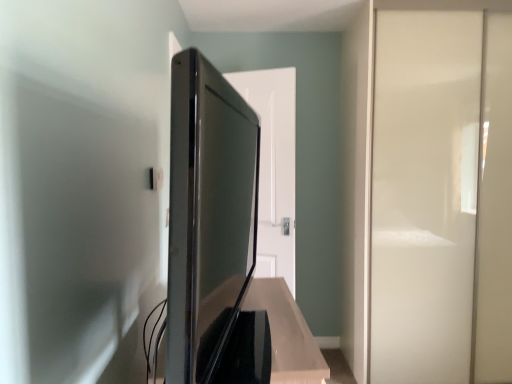
Question: Does satin black tv at center have a greater width compared to white glossy door at center?

Choices:
 (A) no
 (B) yes

Answer: (B)

Question: From the image's perspective, does satin black tv at center appear lower than white glossy door at center?

Choices:
 (A) yes
 (B) no

Answer: (A)

Question: Is satin black tv at center turned away from white glossy door at center?

Choices:
 (A) no
 (B) yes

Answer: (A)

Question: Is satin black tv at center in contact with white glossy door at center?

Choices:
 (A) yes
 (B) no

Answer: (B)

Question: Does satin black tv at center have a lesser height compared to white glossy door at center?

Choices:
 (A) yes
 (B) no

Answer: (A)

Question: Considering the positions of satin black tv at center and white glossy screen door at right in the image, is satin black tv at center bigger or smaller than white glossy screen door at right?

Choices:
 (A) big
 (B) small

Answer: (B)

Question: Is satin black tv at center taller or shorter than white glossy screen door at right?

Choices:
 (A) short
 (B) tall

Answer: (A)

Question: Considering the relative positions of satin black tv at center and white glossy screen door at right in the image provided, is satin black tv at center to the left or to the right of white glossy screen door at right?

Choices:
 (A) left
 (B) right

Answer: (A)

Question: From the image's perspective, is satin black tv at center positioned above or below white glossy screen door at right?

Choices:
 (A) below
 (B) above

Answer: (A)

Question: From their relative heights in the image, would you say white glossy screen door at right is taller or shorter than white glossy door at center?

Choices:
 (A) short
 (B) tall

Answer: (B)

Question: Considering the positions of point (462, 167) and point (283, 163), is point (462, 167) closer or farther from the camera than point (283, 163)?

Choices:
 (A) farther
 (B) closer

Answer: (B)

Question: From the image's perspective, is white glossy screen door at right located above or below white glossy door at center?

Choices:
 (A) above
 (B) below

Answer: (A)

Question: Considering the positions of white glossy screen door at right and white glossy door at center in the image, is white glossy screen door at right wider or thinner than white glossy door at center?

Choices:
 (A) wide
 (B) thin

Answer: (A)

Question: Choose the correct answer: Is white glossy door at center inside white glossy screen door at right or outside it?

Choices:
 (A) outside
 (B) inside

Answer: (A)

Question: From the image's perspective, is white glossy door at center positioned above or below white glossy screen door at right?

Choices:
 (A) below
 (B) above

Answer: (A)